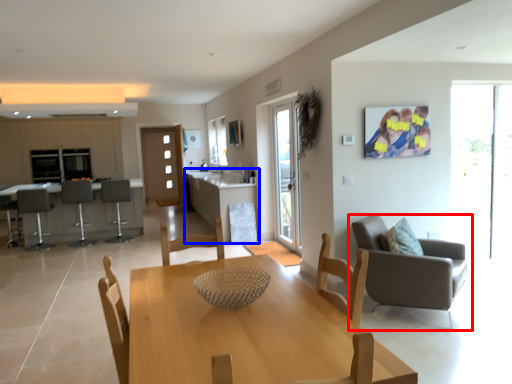
Question: Which object is further to the camera taking this photo, chair (highlighted by a red box) or table (highlighted by a blue box)?

Choices:
 (A) chair
 (B) table

Answer: (B)